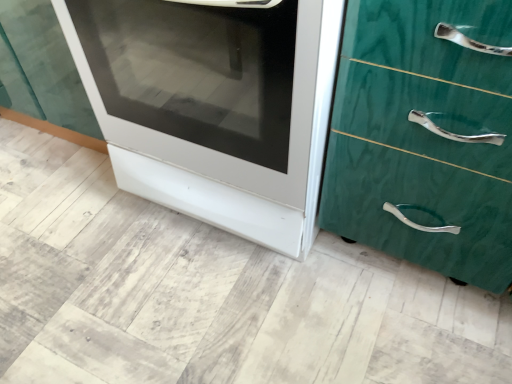
Question: Does white glossy oven at center have a smaller size compared to green marble chest of drawers at right?

Choices:
 (A) yes
 (B) no

Answer: (B)

Question: Is white glossy oven at center surrounding green marble chest of drawers at right?

Choices:
 (A) yes
 (B) no

Answer: (B)

Question: From a real-world perspective, is white glossy oven at center positioned over green marble chest of drawers at right based on gravity?

Choices:
 (A) yes
 (B) no

Answer: (B)

Question: Is white glossy oven at center looking in the opposite direction of green marble chest of drawers at right?

Choices:
 (A) yes
 (B) no

Answer: (B)

Question: Is white glossy oven at center positioned behind green marble chest of drawers at right?

Choices:
 (A) yes
 (B) no

Answer: (A)

Question: From the image's perspective, does white glossy oven at center appear higher than green marble chest of drawers at right?

Choices:
 (A) no
 (B) yes

Answer: (B)

Question: Can you confirm if green marble chest of drawers at right is positioned to the left of white glossy oven at center?

Choices:
 (A) yes
 (B) no

Answer: (B)

Question: Is green marble chest of drawers at right positioned beyond the bounds of white glossy oven at center?

Choices:
 (A) yes
 (B) no

Answer: (A)

Question: Can you confirm if green marble chest of drawers at right is bigger than white glossy oven at center?

Choices:
 (A) yes
 (B) no

Answer: (B)

Question: From a real-world perspective, is green marble chest of drawers at right over white glossy oven at center?

Choices:
 (A) no
 (B) yes

Answer: (B)

Question: Is green marble chest of drawers at right further to camera compared to white glossy oven at center?

Choices:
 (A) yes
 (B) no

Answer: (B)

Question: Is green marble chest of drawers at right taller than white glossy oven at center?

Choices:
 (A) no
 (B) yes

Answer: (A)

Question: In terms of size, does green marble chest of drawers at right appear bigger or smaller than white glossy oven at center?

Choices:
 (A) small
 (B) big

Answer: (A)